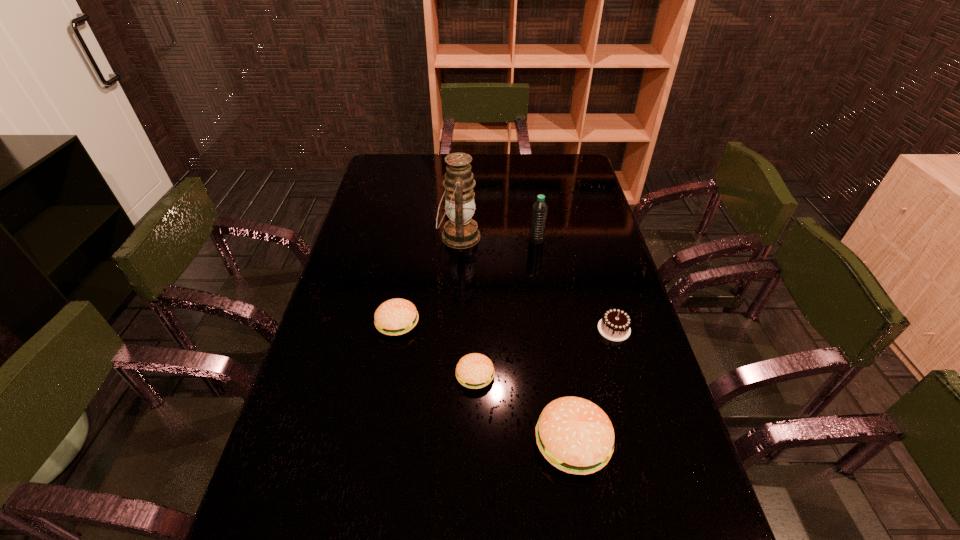
Where is `free region at the left edge`? The height and width of the screenshot is (540, 960). free region at the left edge is located at coordinates (402, 204).

This screenshot has width=960, height=540. In order to click on vacant space at the right edge in this screenshot , I will do `click(622, 282)`.

Where is `vacant space at the far left corner`? The width and height of the screenshot is (960, 540). vacant space at the far left corner is located at coordinates (379, 178).

Locate an element on the screen. The height and width of the screenshot is (540, 960). vacant space at the far right corner of the desktop is located at coordinates (553, 156).

I want to click on free space between the chocolate cake and the leftmost object, so click(x=506, y=326).

Identify the location of empty location between the lantern and the water bottle. (497, 239).

Locate an element on the screen. Image resolution: width=960 pixels, height=540 pixels. free space between the rightmost patty and the shortest object is located at coordinates (524, 409).

Identify the location of vacant space in between the farthest patty and the water bottle. The image size is (960, 540). (468, 282).

Image resolution: width=960 pixels, height=540 pixels. I want to click on free spot between the rightmost object and the fifth farthest object, so click(x=544, y=352).

Where is `vacant area that lies between the shortest object and the leftmost patty`? The height and width of the screenshot is (540, 960). vacant area that lies between the shortest object and the leftmost patty is located at coordinates 437,349.